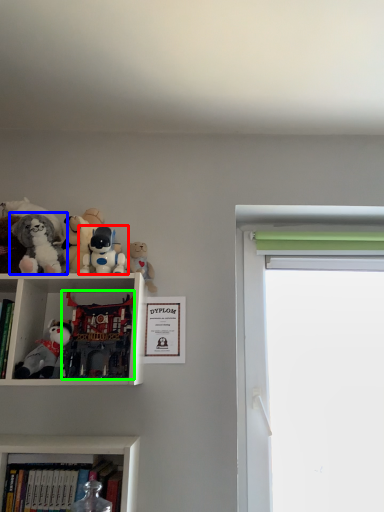
Question: Which is nearer to the toy (highlighted by a red box)? toy (highlighted by a blue box) or toy (highlighted by a green box).

Choices:
 (A) toy
 (B) toy

Answer: (A)